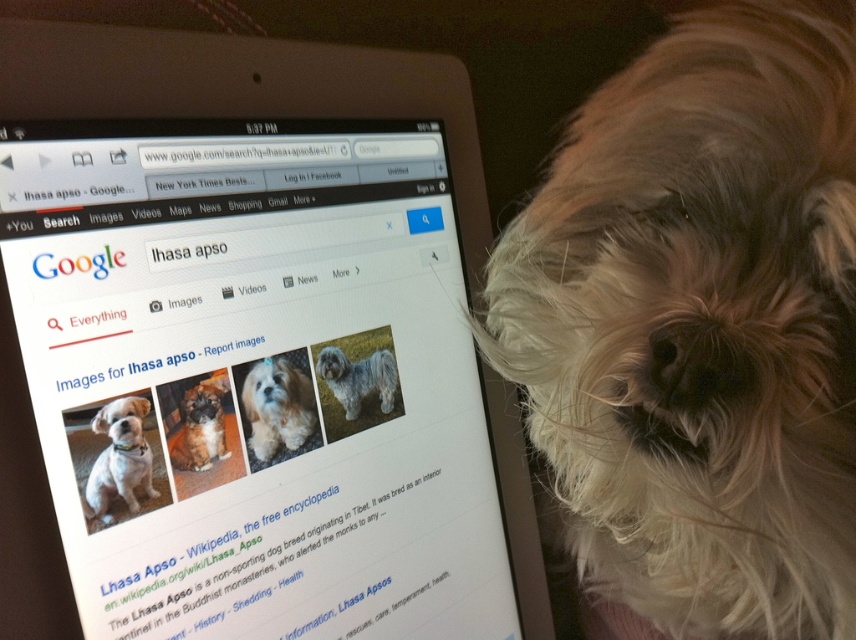
Does fluffy white fur at center come behind fluffy white dog at center?

No, fluffy white fur at center is in front of fluffy white dog at center.

Is point (738, 632) positioned after point (284, 440)?

Yes, it is.

Is point (752, 337) more distant than point (263, 413)?

No.

Where is `fluffy white fur at center`? fluffy white fur at center is located at coordinates (700, 324).

Consider the image. How distant is fluffy white fur at center from fuzzy white dog at center?

fluffy white fur at center and fuzzy white dog at center are 9.07 inches apart from each other.

Who is more distant from viewer, (843, 508) or (381, 385)?

The point (381, 385) is more distant.

What do you see at coordinates (700, 324) in the screenshot? This screenshot has height=640, width=856. I see `fluffy white fur at center` at bounding box center [700, 324].

Locate an element on the screen. fluffy white fur at center is located at coordinates (700, 324).

Is fluffy white dog at center above fuzzy white dog at center?

Incorrect, fluffy white dog at center is not positioned above fuzzy white dog at center.

Is point (311, 413) more distant than point (367, 392)?

No, it is not.

Describe the element at coordinates (277, 406) in the screenshot. The width and height of the screenshot is (856, 640). I see `fluffy white dog at center` at that location.

I want to click on fluffy white dog at center, so click(277, 406).